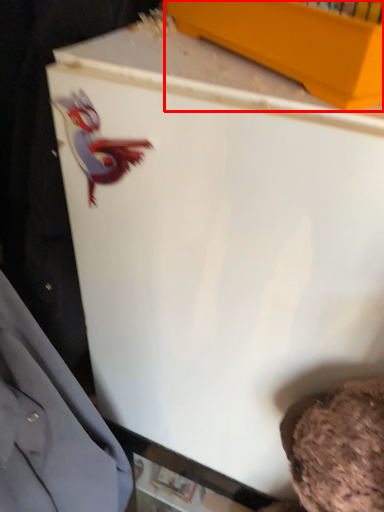
Question: From the image's perspective, where is box (annotated by the red box) located relative to dress shirt?

Choices:
 (A) above
 (B) below

Answer: (A)